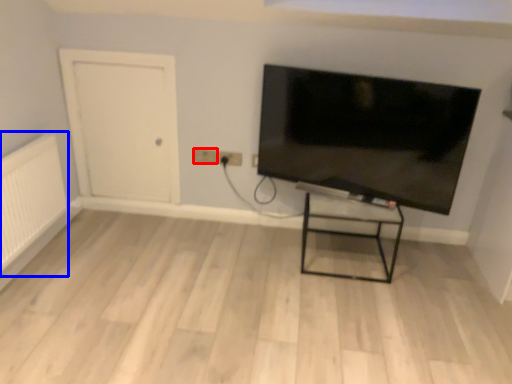
Question: Which object is closer to the camera taking this photo, electric outlet (highlighted by a red box) or radiator (highlighted by a blue box)?

Choices:
 (A) electric outlet
 (B) radiator

Answer: (B)